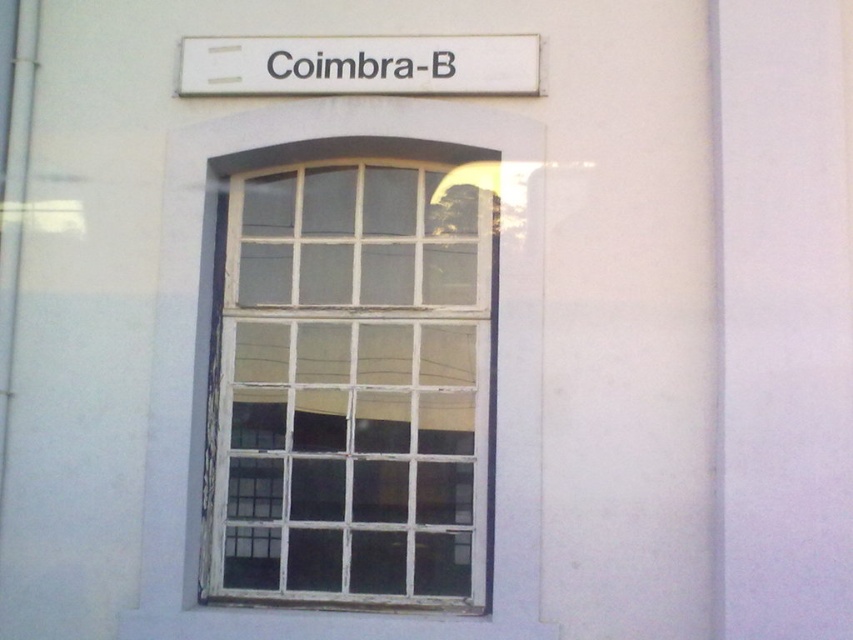
From the picture: You are standing in front of a building with a window and a sign above it. You notice a point marked at coordinates (347, 381). Which object does this point correspond to?

The point at coordinates (347, 381) corresponds to the white wooden window at center.

You are an architect inspecting the building facade. You see the white wooden window at center and the white plastic sign at upper center. Which object is located higher up on the facade?

The white plastic sign at upper center is located higher up on the facade than the white wooden window at center.

You are a painter who needs to decide which tool to use. You have a small brush for detailed work and a large roller for covering big areas. Based on the sizes of the white wooden window at center and the white plastic sign at upper center in the image, which tool should you use for each object?

The white wooden window at center is larger than the white plastic sign at upper center, so use the large roller for the white wooden window at center and the small brush for the white plastic sign at upper center.